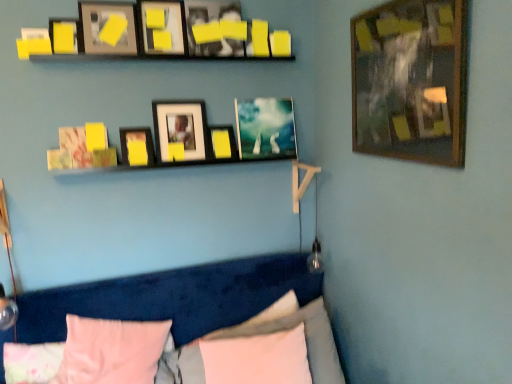
Question: Which direction should I rotate to look at matte black picture frame at upper center, acting as the third picture frame starting from the left, — up or down?

Choices:
 (A) down
 (B) up

Answer: (B)

Question: Can wooden framed picture at upper right, the first picture frame positioned from the right, be found inside pink fabric pillow at lower center, marked as the fifth pillow in a left-to-right arrangement?

Choices:
 (A) no
 (B) yes

Answer: (A)

Question: Is pink fabric pillow at lower center, marked as the fifth pillow in a left-to-right arrangement, taller than wooden framed picture at upper right, the first picture frame positioned from the right?

Choices:
 (A) no
 (B) yes

Answer: (A)

Question: From a real-world perspective, is pink fabric pillow at lower center, which is counted as the first pillow, starting from the right, physically below wooden framed picture at upper right, the 10th picture frame in the left-to-right sequence?

Choices:
 (A) yes
 (B) no

Answer: (A)

Question: Is pink fabric pillow at lower center, which is counted as the first pillow, starting from the right, positioned in front of wooden framed picture at upper right, the first picture frame positioned from the right?

Choices:
 (A) yes
 (B) no

Answer: (B)

Question: From the image's perspective, is pink fabric pillow at lower center, which is counted as the first pillow, starting from the right, above wooden framed picture at upper right, the first picture frame positioned from the right?

Choices:
 (A) no
 (B) yes

Answer: (A)

Question: Is pink fabric pillow at lower center, which is counted as the first pillow, starting from the right, not inside wooden framed picture at upper right, the 10th picture frame in the left-to-right sequence?

Choices:
 (A) no
 (B) yes

Answer: (B)

Question: Is yellow matte picture frame at upper center, which ranks as the third picture frame in right-to-left order, outside of metallic silver picture frame at center, the ninth picture frame positioned from the left?

Choices:
 (A) no
 (B) yes

Answer: (B)

Question: Does yellow matte picture frame at upper center, which ranks as the third picture frame in right-to-left order, come in front of metallic silver picture frame at center, which is counted as the 2th picture frame, starting from the right?

Choices:
 (A) no
 (B) yes

Answer: (B)

Question: Is yellow matte picture frame at upper center, which appears as the 8th picture frame when viewed from the left, facing away from metallic silver picture frame at center, which is counted as the 2th picture frame, starting from the right?

Choices:
 (A) yes
 (B) no

Answer: (B)

Question: Are yellow matte picture frame at upper center, which ranks as the third picture frame in right-to-left order, and metallic silver picture frame at center, which is counted as the 2th picture frame, starting from the right, beside each other?

Choices:
 (A) no
 (B) yes

Answer: (A)

Question: Can you confirm if yellow matte picture frame at upper center, which appears as the 8th picture frame when viewed from the left, is positioned to the right of metallic silver picture frame at center, the ninth picture frame positioned from the left?

Choices:
 (A) no
 (B) yes

Answer: (A)

Question: Considering the relative sizes of yellow matte picture frame at upper center, which ranks as the third picture frame in right-to-left order, and metallic silver picture frame at center, the ninth picture frame positioned from the left, in the image provided, is yellow matte picture frame at upper center, which ranks as the third picture frame in right-to-left order, shorter than metallic silver picture frame at center, the ninth picture frame positioned from the left,?

Choices:
 (A) no
 (B) yes

Answer: (B)

Question: Is matte black picture frame at upper center, the 4th picture frame in the left-to-right sequence, positioned in front of yellow matte picture frame at upper center, acting as the fifth picture frame starting from the left?

Choices:
 (A) yes
 (B) no

Answer: (B)